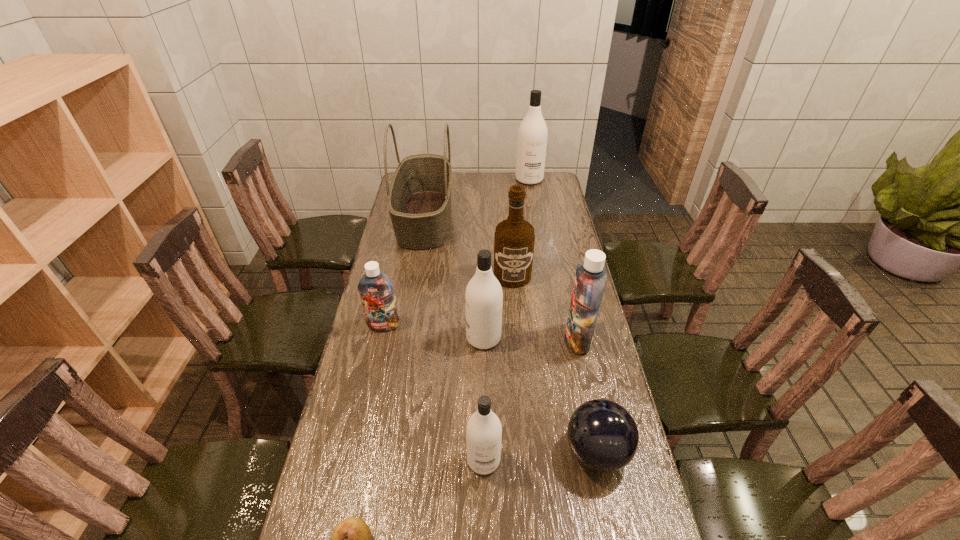
Identify the location of the farthest white shampoo. (532, 135).

Where is `the rightmost white shampoo`? The width and height of the screenshot is (960, 540). the rightmost white shampoo is located at coordinates (532, 135).

You are a GUI agent. You are given a task and a screenshot of the screen. Output one action in this format:
    pyautogui.click(x=<x>, y=<y>)
    Task: Click on the eighth nearest object
    The width and height of the screenshot is (960, 540).
    Given the screenshot: What is the action you would take?
    pyautogui.click(x=419, y=200)

This screenshot has height=540, width=960. What are the coordinates of `brown alcohol` in the screenshot? It's located at 514,238.

Image resolution: width=960 pixels, height=540 pixels. Find the location of `alcohol`. alcohol is located at coordinates (514, 238).

Locate an element on the screen. the right blue shampoo is located at coordinates (590, 279).

At what (x,y) coordinates should I click in order to perform the action: click on the second smallest white shampoo. Please return your answer as a coordinate pair (x, y). Image resolution: width=960 pixels, height=540 pixels. Looking at the image, I should click on (483, 297).

Where is `the smaller blue shampoo`? The width and height of the screenshot is (960, 540). the smaller blue shampoo is located at coordinates (376, 290).

Image resolution: width=960 pixels, height=540 pixels. Find the location of `the leftmost shampoo`. the leftmost shampoo is located at coordinates (376, 290).

This screenshot has height=540, width=960. I want to click on the nearest shampoo, so click(484, 431).